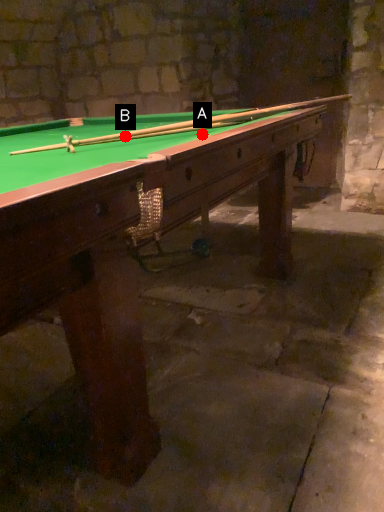
Question: Two points are circled on the image, labeled by A and B beside each circle. Which of the following is the closest to the observer?

Choices:
 (A) A is closer
 (B) B is closer

Answer: (A)